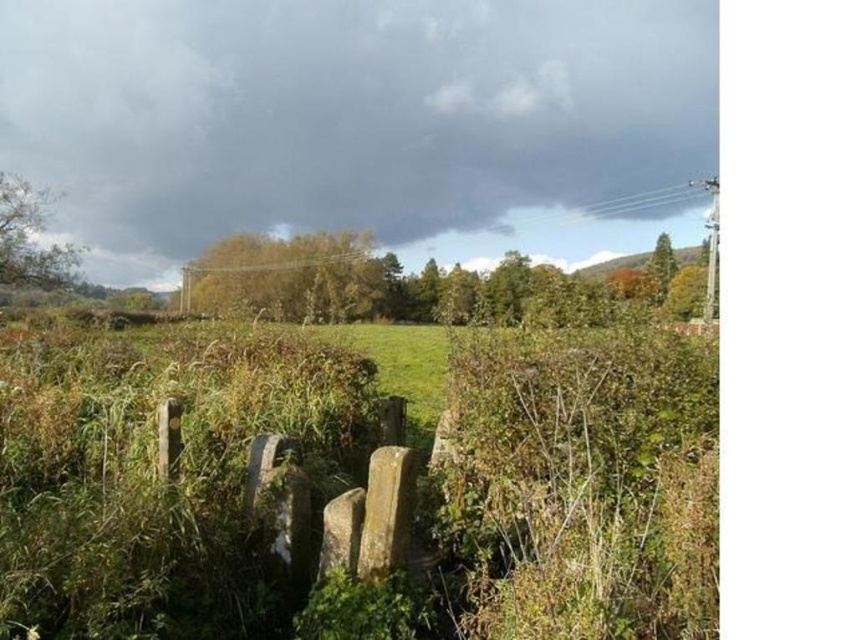
Does green leafy tree at center have a smaller size compared to yellow-green foliage at upper center?

Incorrect, green leafy tree at center is not smaller in size than yellow-green foliage at upper center.

Is green leafy tree at center wider than yellow-green foliage at upper center?

Yes, green leafy tree at center is wider than yellow-green foliage at upper center.

At what (x,y) coordinates should I click in order to perform the action: click on green leafy tree at center. Please return your answer as a coordinate pair (x, y). Looking at the image, I should click on (420, 285).

Who is more distant from viewer, (16, 193) or (666, 240)?

The point (666, 240) is more distant.

In order to click on green leafy tree at upper left in this screenshot , I will do `click(30, 241)`.

Which is behind, point (73, 252) or point (667, 234)?

Point (667, 234)

This screenshot has width=856, height=640. I want to click on green leafy tree at upper left, so click(x=30, y=241).

Is the position of green leafy tree at center less distant than that of green leafy tree at upper right?

Yes, it is in front of green leafy tree at upper right.

Is green leafy tree at center shorter than green leafy tree at upper right?

No.

Measure the distance between point (x=531, y=314) and camera.

Point (x=531, y=314) is 53.96 meters away from camera.

You are a GUI agent. You are given a task and a screenshot of the screen. Output one action in this format:
    pyautogui.click(x=<x>, y=<y>)
    Task: Click on the green leafy tree at center
    This screenshot has width=856, height=640.
    Given the screenshot: What is the action you would take?
    pyautogui.click(x=420, y=285)